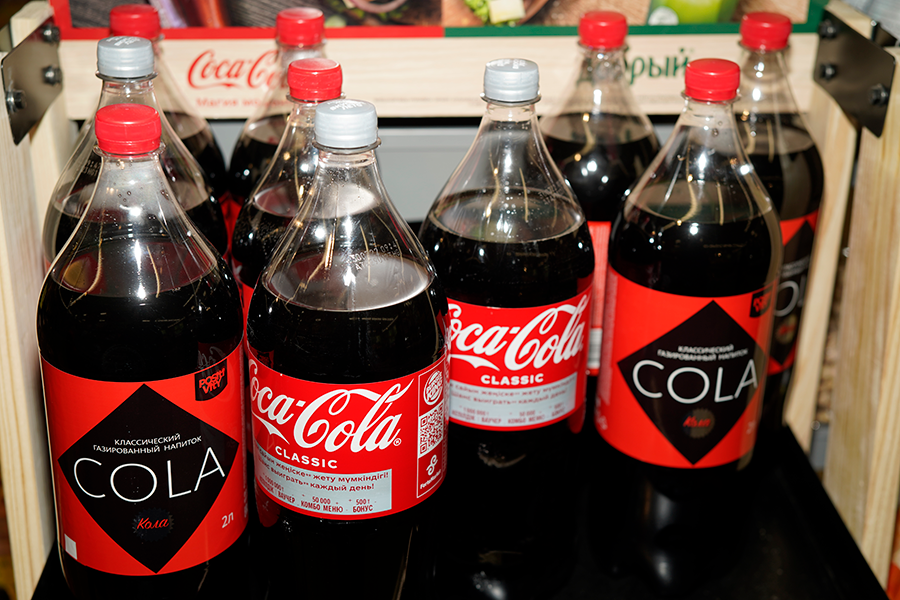
Locate an element on the screen. The image size is (900, 600). screws is located at coordinates (877, 94), (824, 70), (823, 30), (56, 35), (55, 77), (18, 98).